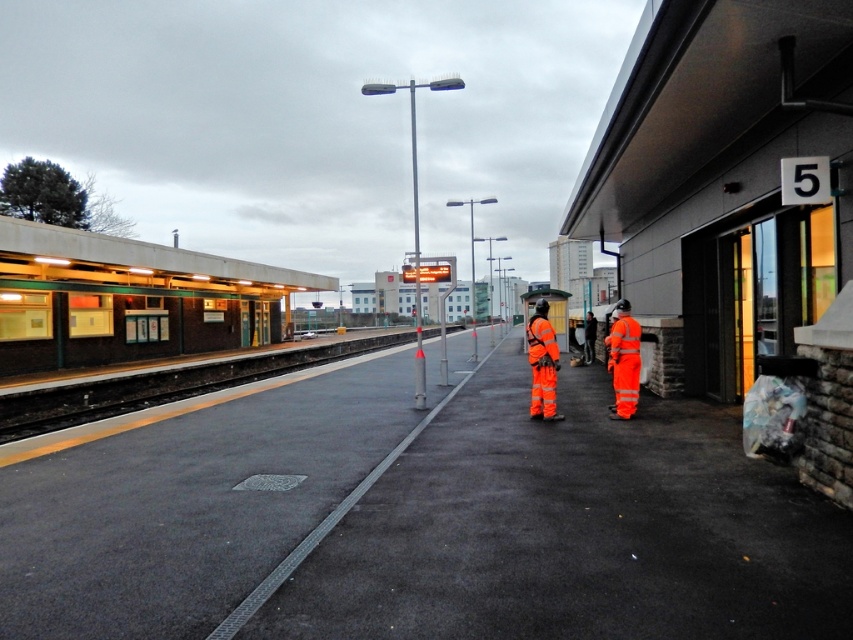
You are a visually impaired person using a cane to navigate the train station platform. You want to locate the high visibility orange reflective jacket at center. Based on the coordinates provided, where should you walk from your current position at point 0.5, 0.5?

The high visibility orange reflective jacket at center is located at coordinates (x=543, y=364). From your current position at (x=426, y=320), you should walk northeast to reach it.

You are a pedestrian standing at the edge of the platform near the tracks. You need to walk to the orange reflective safety vest at center to ask for directions. However, there is a high visibility orange reflective jacket at center in your path. Can you safely walk around the jacket without getting too close? Please consider the distance between them.

The high visibility orange reflective jacket at center is 9.34 meters away from the orange reflective safety vest at center. Since the distance is quite large, you can easily walk around the jacket while maintaining a safe distance and reach the vest.